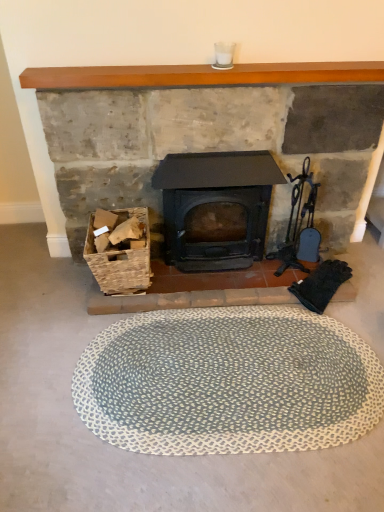
This screenshot has width=384, height=512. I want to click on free space above blue textured bath mat at center (from a real-world perspective), so click(x=229, y=372).